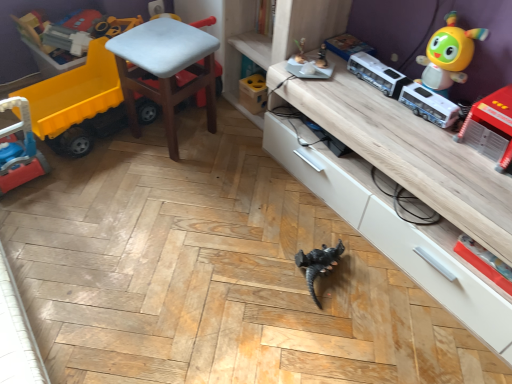
You are a GUI agent. You are given a task and a screenshot of the screen. Output one action in this format:
    pyautogui.click(x=<x>, y=<y>)
    Task: Click on the vacant area situated below white plastic chair at center (from a real-world perspective)
    
    Given the screenshot: What is the action you would take?
    pyautogui.click(x=177, y=137)